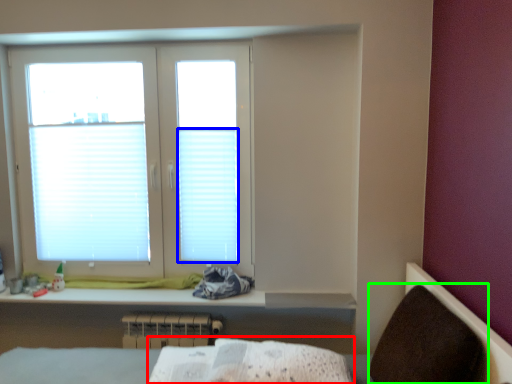
Question: Which is farther away from sheet (highlighted by a red box)? blind (highlighted by a blue box) or armchair (highlighted by a green box)?

Choices:
 (A) blind
 (B) armchair

Answer: (A)